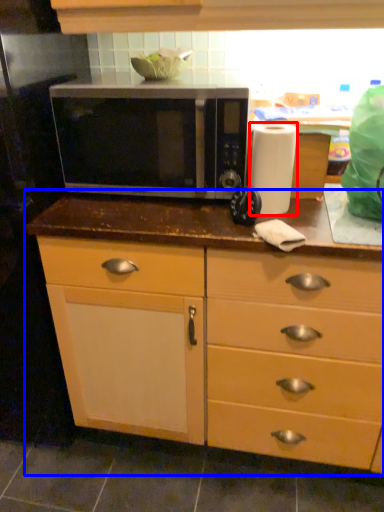
Question: Which object appears closest to the camera in this image, paper towel (highlighted by a red box) or cabinetry (highlighted by a blue box)?

Choices:
 (A) paper towel
 (B) cabinetry

Answer: (B)